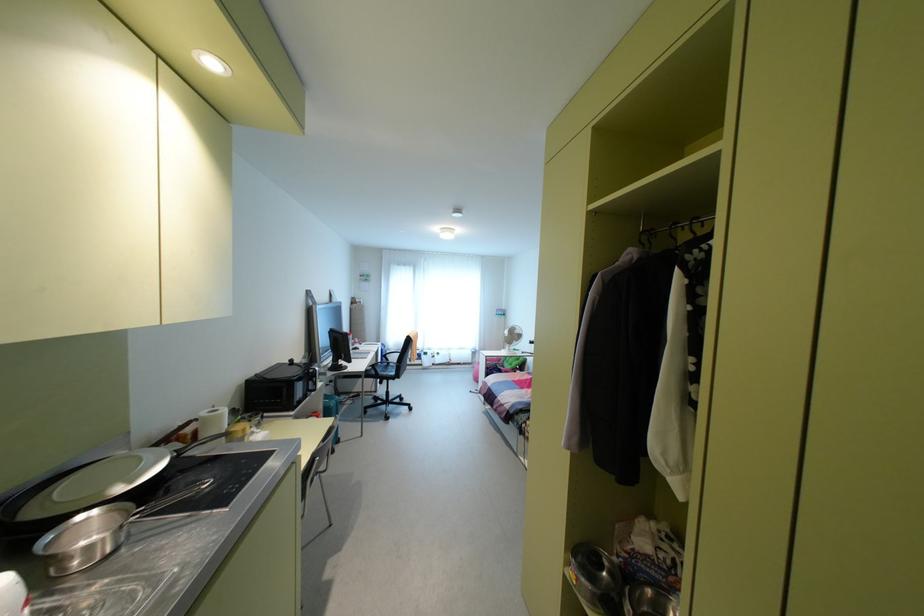
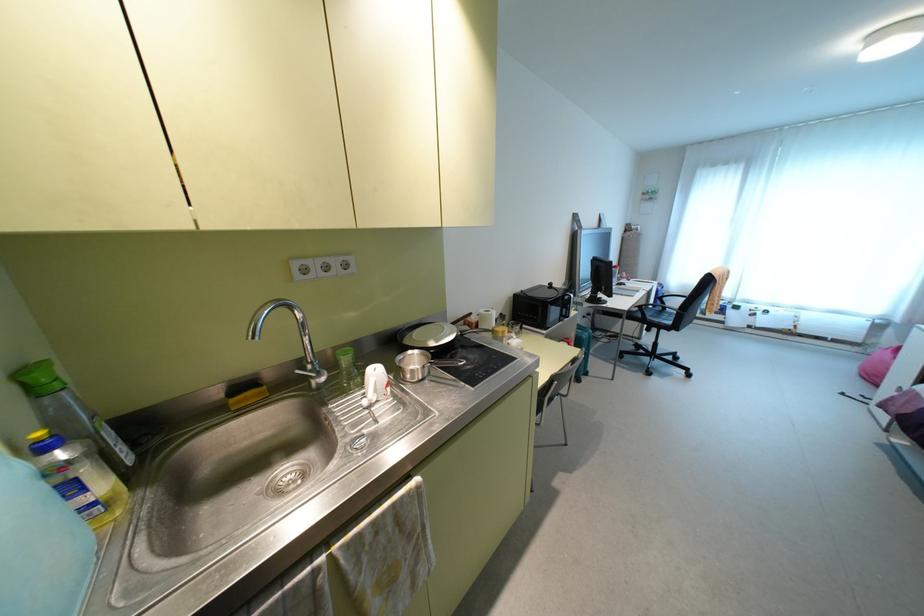
Where in the second image is the point corresponding to the point at 310,482 from the first image?

(551, 399)